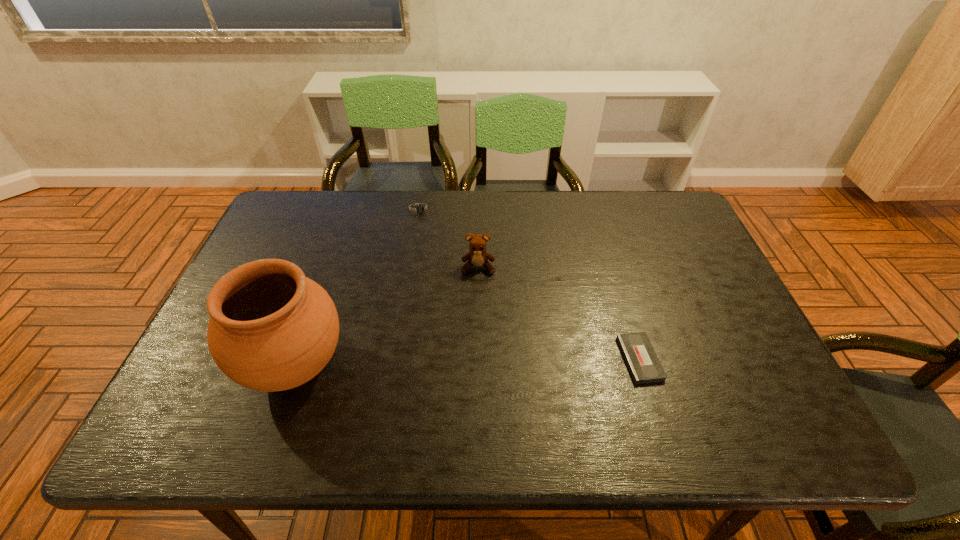
Image resolution: width=960 pixels, height=540 pixels. I want to click on vacant region located on the front-facing side of the third object from left to right, so click(474, 399).

At what (x,y) coordinates should I click in order to perform the action: click on vacant space situated on the front-facing side of the third object from left to right. Please return your answer as a coordinate pair (x, y). This screenshot has height=540, width=960. Looking at the image, I should click on (477, 295).

Where is `vacant area situated 0.120m on the front-facing side of the third object from left to right`? The height and width of the screenshot is (540, 960). vacant area situated 0.120m on the front-facing side of the third object from left to right is located at coordinates (477, 309).

The image size is (960, 540). Find the location of `vacant region located 0.050m on the face of the second shortest object`. vacant region located 0.050m on the face of the second shortest object is located at coordinates (425, 228).

I want to click on vacant area situated on the face of the second shortest object, so click(440, 285).

You are a GUI agent. You are given a task and a screenshot of the screen. Output one action in this format:
    pyautogui.click(x=<x>, y=<y>)
    Task: Click on the free space located 0.060m on the face of the second shortest object
    This screenshot has width=960, height=540.
    Given the screenshot: What is the action you would take?
    [x=426, y=231]

Where is `object at the far edge`? object at the far edge is located at coordinates (421, 208).

In order to click on pottery that is at the near edge in this screenshot , I will do `click(271, 329)`.

At what (x,y) coordinates should I click in order to perform the action: click on videotape that is positioned at the near edge. Please return your answer as a coordinate pair (x, y). This screenshot has height=540, width=960. Looking at the image, I should click on (641, 359).

The image size is (960, 540). I want to click on object present at the left edge, so click(271, 329).